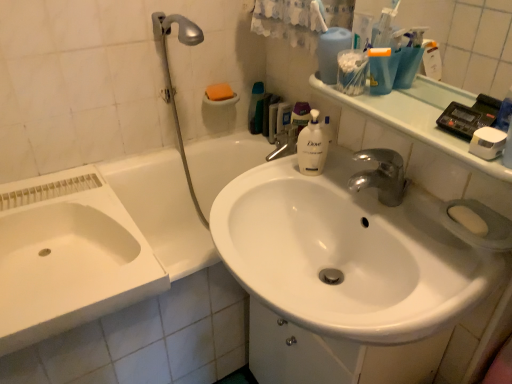
Question: Which direction should I rotate to face white matte liquid soap at center, positioned as the second cleaning product in back-to-front order, — up or down?

Choices:
 (A) up
 (B) down

Answer: (A)

Question: Is white glossy sink at center, the 2th sink from the left, outside silver metallic shower head at upper left?

Choices:
 (A) yes
 (B) no

Answer: (A)

Question: From the image's perspective, is white glossy sink at center, arranged as the 1th sink when viewed from the right, on top of silver metallic shower head at upper left?

Choices:
 (A) yes
 (B) no

Answer: (B)

Question: Is white glossy sink at center, arranged as the 1th sink when viewed from the right, in front of silver metallic shower head at upper left?

Choices:
 (A) yes
 (B) no

Answer: (A)

Question: Could you tell me if white glossy sink at center, the 2th sink from the left, is facing silver metallic shower head at upper left?

Choices:
 (A) yes
 (B) no

Answer: (B)

Question: Is white glossy sink at center, the 2th sink from the left, taller than silver metallic shower head at upper left?

Choices:
 (A) yes
 (B) no

Answer: (B)

Question: Is white glossy sink at center, the 2th sink from the left, facing away from silver metallic shower head at upper left?

Choices:
 (A) no
 (B) yes

Answer: (A)

Question: From a real-world perspective, does white glossy bathtub at lower left stand above silver metallic shower head at upper left?

Choices:
 (A) yes
 (B) no

Answer: (B)

Question: Does white glossy bathtub at lower left have a lesser width compared to silver metallic shower head at upper left?

Choices:
 (A) yes
 (B) no

Answer: (B)

Question: Does white glossy bathtub at lower left turn towards silver metallic shower head at upper left?

Choices:
 (A) no
 (B) yes

Answer: (A)

Question: Is white glossy bathtub at lower left closer to the viewer compared to silver metallic shower head at upper left?

Choices:
 (A) yes
 (B) no

Answer: (A)

Question: Is white glossy bathtub at lower left further to the viewer compared to silver metallic shower head at upper left?

Choices:
 (A) yes
 (B) no

Answer: (B)

Question: Is white glossy bathtub at lower left wider than silver metallic shower head at upper left?

Choices:
 (A) no
 (B) yes

Answer: (B)

Question: Is clear plastic container at upper right not inside orange sponge at upper center, which ranks as the second soap in bottom-to-top order?

Choices:
 (A) yes
 (B) no

Answer: (A)